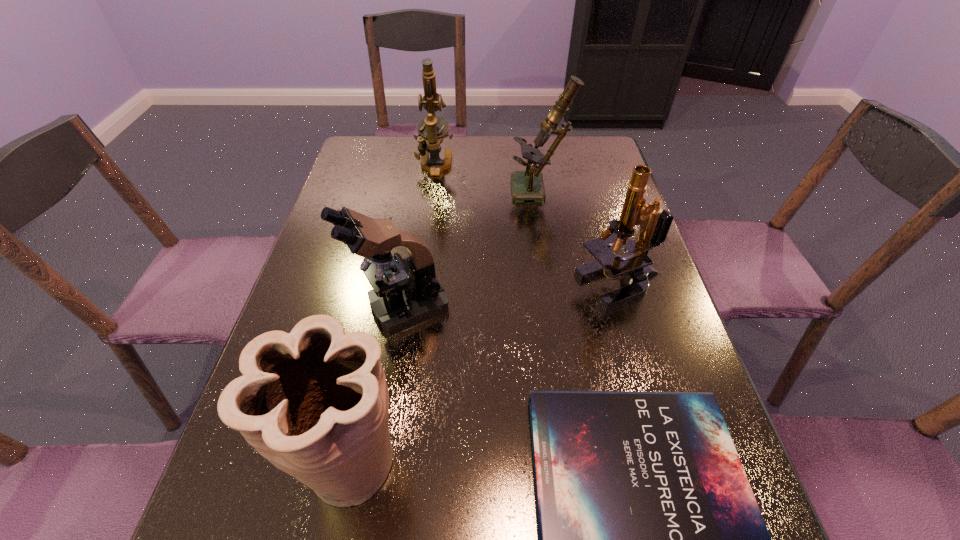
This screenshot has height=540, width=960. What are the coordinates of `free location at the right edge` in the screenshot? It's located at (681, 386).

Where is `free space at the far left corner`? The image size is (960, 540). free space at the far left corner is located at coordinates (400, 134).

Find the location of `vacant space at the far right corner of the desktop`. vacant space at the far right corner of the desktop is located at coordinates (604, 153).

Locate an element on the screen. The width and height of the screenshot is (960, 540). object that is the third nearest to the shortest object is located at coordinates (635, 266).

At what (x,y) coordinates should I click in order to perform the action: click on object that is the second closest to the urn. Please return your answer as a coordinate pair (x, y). Looking at the image, I should click on (650, 537).

This screenshot has width=960, height=540. What are the coordinates of `microscope object that ranks as the fourth closest to the hardback book` in the screenshot? It's located at (432, 129).

Identify which microscope is the fourth nearest to the shortest object. Please provide its 2D coordinates. Your answer should be formatted as a tuple, i.e. [(x, y)], where the tuple contains the x and y coordinates of a point satisfying the conditions above.

[(432, 129)]